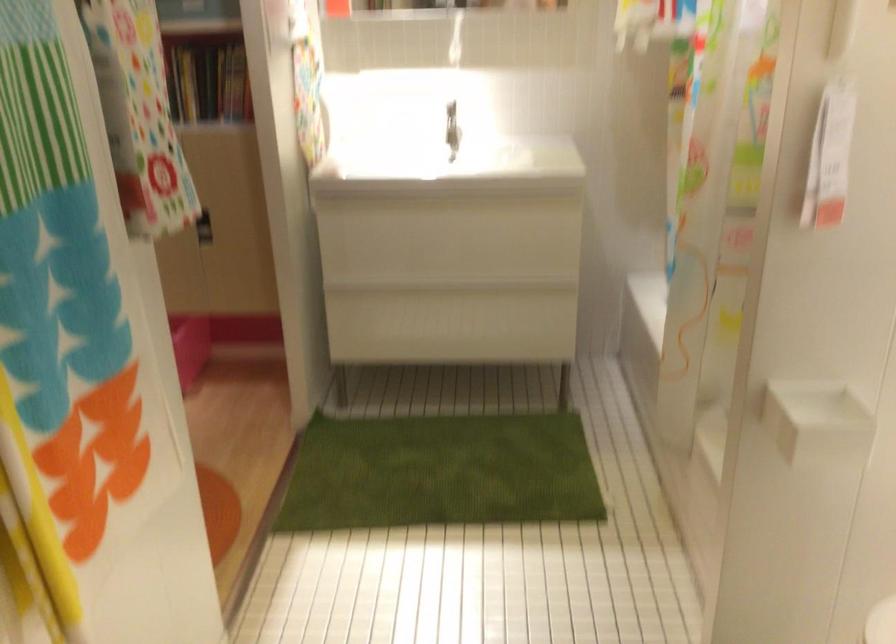
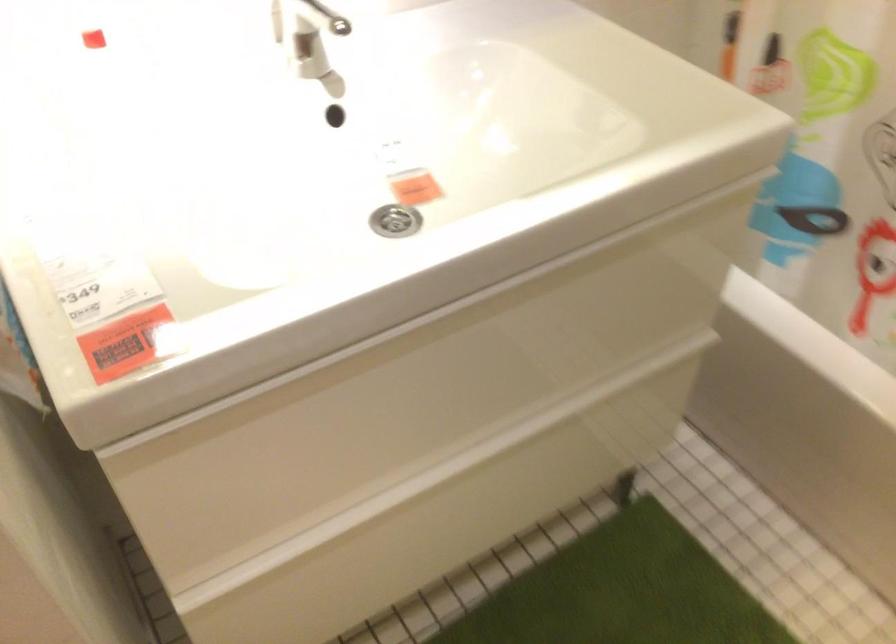
Where in the second image is the point corresponding to (x=457, y=196) from the first image?

(394, 221)